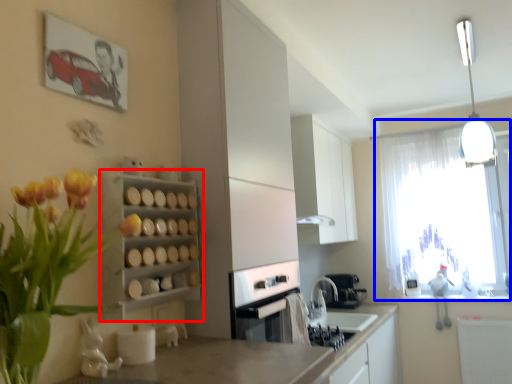
Question: Among these objects, which one is nearest to the camera, shelf (highlighted by a red box) or window (highlighted by a blue box)?

Choices:
 (A) shelf
 (B) window

Answer: (A)